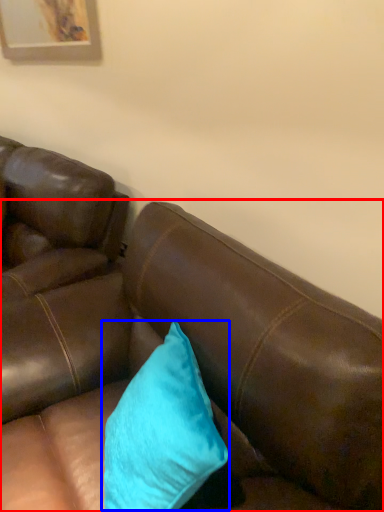
Question: Which object appears closest to the camera in this image, studio couch (highlighted by a red box) or pillow (highlighted by a blue box)?

Choices:
 (A) studio couch
 (B) pillow

Answer: (A)